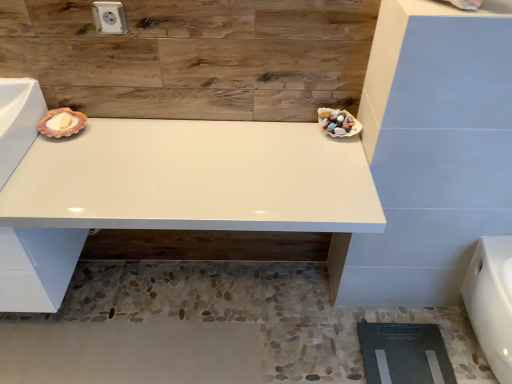
Question: Does white plastic electric outlet at upper center have a lesser width compared to white glossy vanity at center?

Choices:
 (A) no
 (B) yes

Answer: (B)

Question: Is white plastic electric outlet at upper center taller than white glossy vanity at center?

Choices:
 (A) no
 (B) yes

Answer: (A)

Question: Is white plastic electric outlet at upper center bigger than white glossy vanity at center?

Choices:
 (A) no
 (B) yes

Answer: (A)

Question: From the image's perspective, is white plastic electric outlet at upper center on white glossy vanity at center?

Choices:
 (A) yes
 (B) no

Answer: (A)

Question: From a real-world perspective, is white plastic electric outlet at upper center physically above white glossy vanity at center?

Choices:
 (A) no
 (B) yes

Answer: (B)

Question: Can you confirm if white plastic electric outlet at upper center is smaller than white glossy vanity at center?

Choices:
 (A) no
 (B) yes

Answer: (B)

Question: Is white glossy vanity at center looking in the opposite direction of white glossy porcelain at lower right?

Choices:
 (A) yes
 (B) no

Answer: (B)

Question: Considering the relative sizes of white glossy vanity at center and white glossy porcelain at lower right in the image provided, is white glossy vanity at center taller than white glossy porcelain at lower right?

Choices:
 (A) no
 (B) yes

Answer: (B)

Question: Considering the relative sizes of white glossy vanity at center and white glossy porcelain at lower right in the image provided, is white glossy vanity at center smaller than white glossy porcelain at lower right?

Choices:
 (A) yes
 (B) no

Answer: (B)

Question: Does white glossy vanity at center have a greater width compared to white glossy porcelain at lower right?

Choices:
 (A) no
 (B) yes

Answer: (B)

Question: Does white glossy vanity at center come in front of white glossy porcelain at lower right?

Choices:
 (A) no
 (B) yes

Answer: (B)

Question: From the image's perspective, is white glossy vanity at center above white glossy porcelain at lower right?

Choices:
 (A) no
 (B) yes

Answer: (B)

Question: Can you confirm if white glossy porcelain at lower right is bigger than white glossy vanity at center?

Choices:
 (A) no
 (B) yes

Answer: (A)